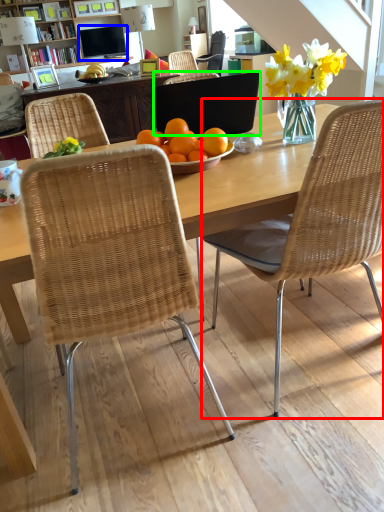
Question: Considering the real-world distances, which object is closest to chair (highlighted by a red box)? television (highlighted by a blue box) or laptop (highlighted by a green box).

Choices:
 (A) television
 (B) laptop

Answer: (B)